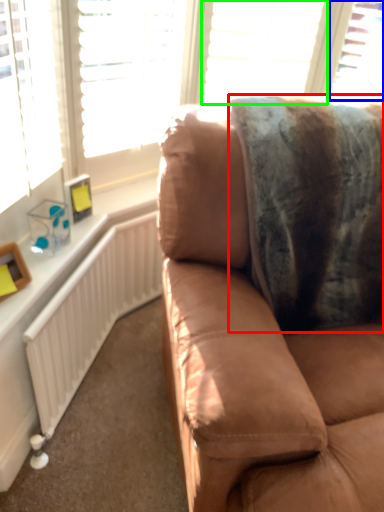
Question: Which is nearer to the blanket (highlighted by a red box)? window (highlighted by a blue box) or blind (highlighted by a green box).

Choices:
 (A) window
 (B) blind

Answer: (B)